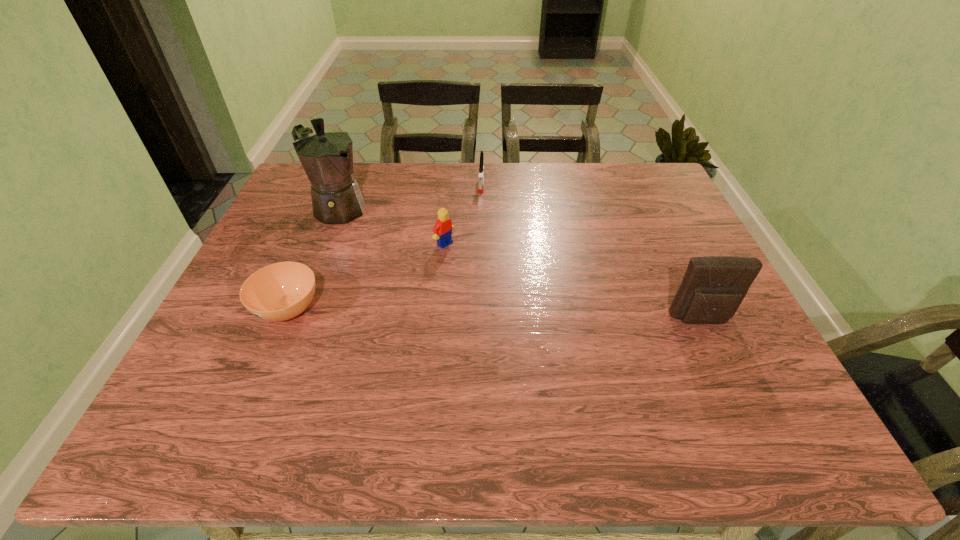
Identify the location of the shortest object. (281, 291).

Locate an element on the screen. Image resolution: width=960 pixels, height=540 pixels. pouch is located at coordinates (713, 287).

Where is `the rightmost object`? the rightmost object is located at coordinates (713, 287).

You are a GUI agent. You are given a task and a screenshot of the screen. Output one action in this format:
    pyautogui.click(x=<x>, y=<y>)
    Task: Click on the tallest object
    This screenshot has width=960, height=540.
    Given the screenshot: What is the action you would take?
    pyautogui.click(x=326, y=155)

The height and width of the screenshot is (540, 960). Identify the location of the third shortest object. (442, 230).

Where is `the third nearest object`? The image size is (960, 540). the third nearest object is located at coordinates (442, 230).

The image size is (960, 540). In order to click on stapler in this screenshot , I will do `click(481, 173)`.

The width and height of the screenshot is (960, 540). I want to click on the second shortest object, so click(481, 173).

You are a GUI agent. You are given a task and a screenshot of the screen. Output one action in this format:
    pyautogui.click(x=<x>, y=<y>)
    Task: Click on the vacant area situated 0.090m on the back of the soup bowl
    
    Given the screenshot: What is the action you would take?
    pyautogui.click(x=308, y=260)

Find the location of a particular element. free space located 0.070m with an open flap on the second tallest object is located at coordinates (718, 355).